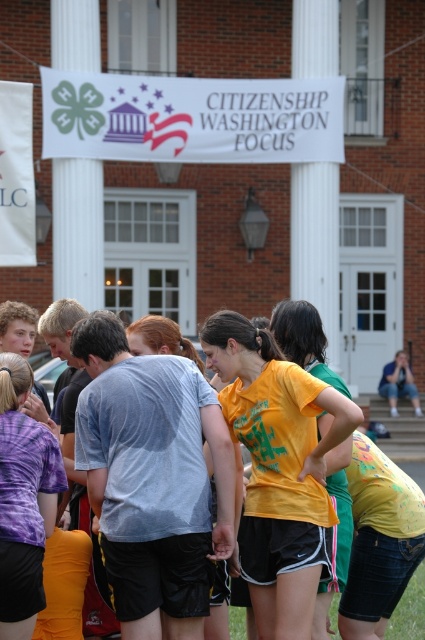
Question: Which point is farther to the camera?

Choices:
 (A) (314, 65)
 (B) (323, 509)
 (C) (8, 612)
 (D) (65, 211)

Answer: (A)

Question: Which point is farther from the camera taking this photo?

Choices:
 (A) (81, 221)
 (B) (317, 285)
 (C) (337, 412)
 (D) (2, 604)

Answer: (B)

Question: Considering the real-world distances, which object is farthest from the yellow matte t-shirt at center?

Choices:
 (A) purple tie-dye shirt at lower left
 (B) white smooth column at center
 (C) white smooth column at upper left

Answer: (B)

Question: Is yellow matte t-shirt at center thinner than white smooth column at upper left?

Choices:
 (A) no
 (B) yes

Answer: (A)

Question: Can you confirm if yellow matte t-shirt at center is positioned below purple tie-dye shirt at lower left?

Choices:
 (A) yes
 (B) no

Answer: (B)

Question: In this image, where is yellow matte t-shirt at center located relative to white smooth column at upper left?

Choices:
 (A) below
 (B) above

Answer: (A)